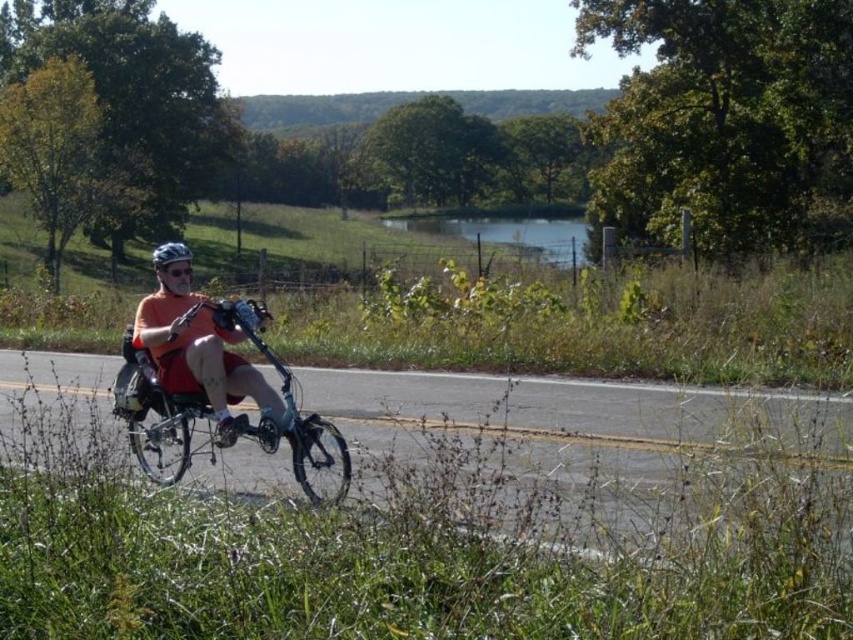
Question: Can you confirm if silver metallic bicycle at center is thinner than orange matte shirt at center?

Choices:
 (A) yes
 (B) no

Answer: (B)

Question: Considering the relative positions of silver metallic bicycle at center and orange matte shirt at center in the image provided, where is silver metallic bicycle at center located with respect to orange matte shirt at center?

Choices:
 (A) above
 (B) below

Answer: (B)

Question: Is silver metallic bicycle at center bigger than orange matte shirt at center?

Choices:
 (A) yes
 (B) no

Answer: (A)

Question: Which object is the farthest from the orange matte shirt at center?

Choices:
 (A) matte black helmet at center
 (B) silver metallic bicycle at center

Answer: (A)

Question: Considering the real-world distances, which object is closest to the orange matte shirt at center?

Choices:
 (A) silver metallic bicycle at center
 (B) matte black helmet at center

Answer: (A)

Question: Which point is closer to the camera?

Choices:
 (A) (131, 346)
 (B) (270, 404)

Answer: (B)